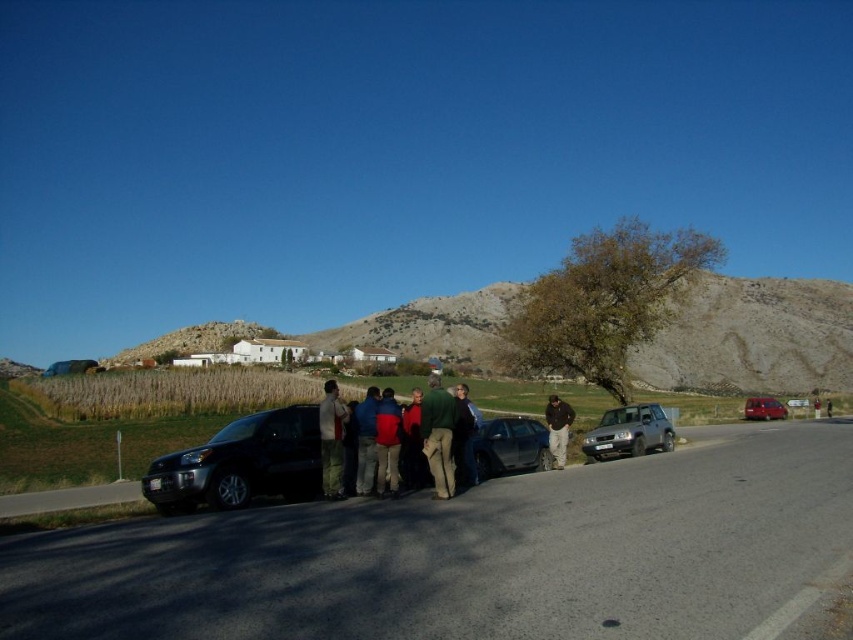
Is green wool sweater at center shorter than dark green jacket at center?

No, green wool sweater at center is not shorter than dark green jacket at center.

Consider the image. Who is lower down, green wool sweater at center or dark green jacket at center?

Positioned lower is green wool sweater at center.

Image resolution: width=853 pixels, height=640 pixels. Describe the element at coordinates (438, 435) in the screenshot. I see `green wool sweater at center` at that location.

At what (x,y) coordinates should I click in order to perform the action: click on green wool sweater at center. Please return your answer as a coordinate pair (x, y). The height and width of the screenshot is (640, 853). Looking at the image, I should click on (438, 435).

Can you confirm if blue fabric jacket at center is bigger than brown leather jacket at center?

Actually, blue fabric jacket at center might be smaller than brown leather jacket at center.

The width and height of the screenshot is (853, 640). Describe the element at coordinates (366, 440) in the screenshot. I see `blue fabric jacket at center` at that location.

Which is in front, point (368, 426) or point (564, 412)?

Point (368, 426) is in front.

Locate an element on the screen. This screenshot has height=640, width=853. blue fabric jacket at center is located at coordinates (366, 440).

In the scene shown: Which of these two, satin black suv at lower left or metallic blue sedan at center, stands taller?

satin black suv at lower left

Locate an element on the screen. satin black suv at lower left is located at coordinates (241, 464).